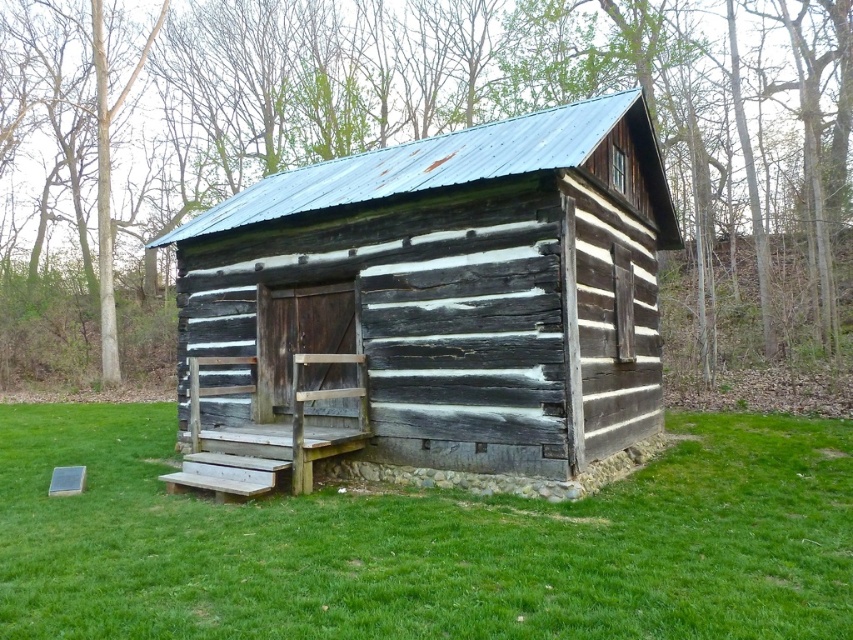
Is weathered wood cabin at center bigger than green grass at lower center?

No.

I want to click on weathered wood cabin at center, so [x=437, y=308].